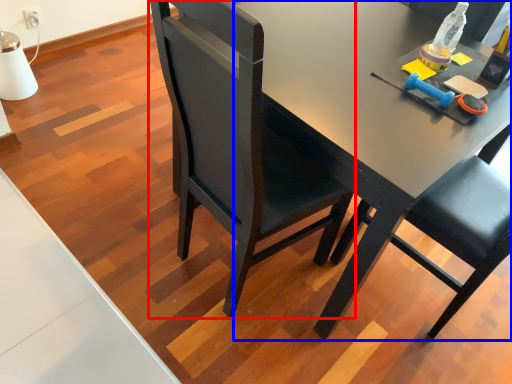
Question: Which object is closer to the camera taking this photo, chair (highlighted by a red box) or desk (highlighted by a blue box)?

Choices:
 (A) chair
 (B) desk

Answer: (A)